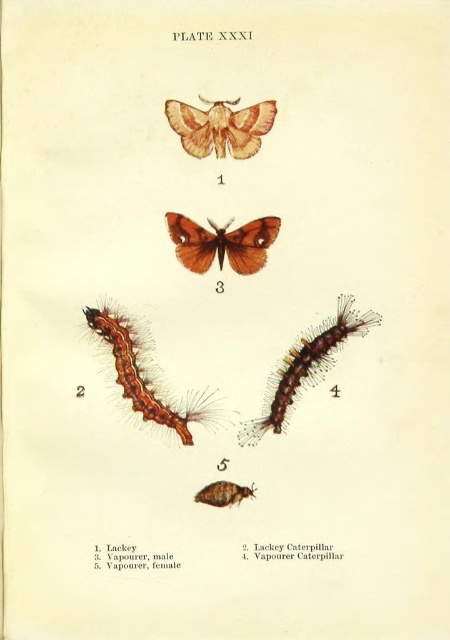
Question: Is the position of fuzzy brown caterpillar at lower left more distant than that of brown textured moth at upper center?

Choices:
 (A) no
 (B) yes

Answer: (B)

Question: Based on their relative distances, which object is nearer to the brown fuzzy caterpillar at center?

Choices:
 (A) shiny brown moth at center
 (B) fuzzy brown caterpillar at lower left

Answer: (B)

Question: Is fuzzy brown caterpillar at lower left in front of shiny brown moth at center?

Choices:
 (A) yes
 (B) no

Answer: (B)

Question: Which object appears closest to the camera in this image?

Choices:
 (A) fuzzy brown caterpillar at center right
 (B) shiny brown moth at center

Answer: (B)

Question: Which point appears closest to the camera in this image?

Choices:
 (A) [211, 108]
 (B) [265, 417]

Answer: (A)

Question: From the image, what is the correct spatial relationship of fuzzy brown caterpillar at center right in relation to shiny brown moth at center?

Choices:
 (A) below
 (B) above

Answer: (A)